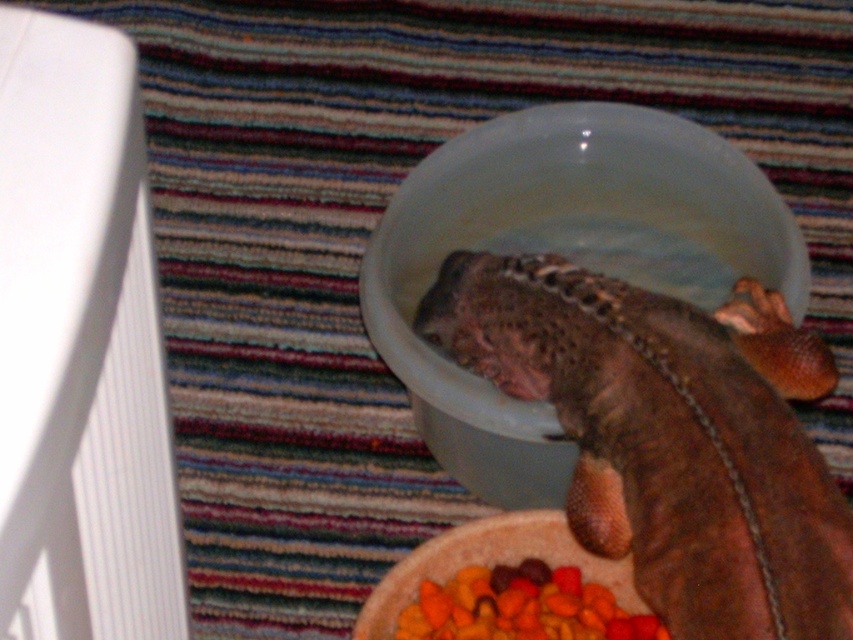
Which is above, brown scaly lizard at center or translucent plastic bowl at center?

translucent plastic bowl at center is above.

Which of these two, brown scaly lizard at center or translucent plastic bowl at center, stands taller?

translucent plastic bowl at center

Where is `brown scaly lizard at center`? The width and height of the screenshot is (853, 640). brown scaly lizard at center is located at coordinates (669, 436).

Image resolution: width=853 pixels, height=640 pixels. In order to click on brown scaly lizard at center in this screenshot , I will do `click(669, 436)`.

Is translucent plastic bowl at center bigger than carrot-like pieces at lower center?

Correct, translucent plastic bowl at center is larger in size than carrot-like pieces at lower center.

Does point (753, 198) come in front of point (552, 625)?

No, (753, 198) is behind (552, 625).

Identify the location of translucent plastic bowl at center. This screenshot has width=853, height=640. (566, 256).

Is brown scaly lizard at center thinner than carrot-like pieces at lower center?

No.

Who is positioned more to the left, brown scaly lizard at center or carrot-like pieces at lower center?

From the viewer's perspective, carrot-like pieces at lower center appears more on the left side.

Consider the image. Measure the distance between brown scaly lizard at center and camera.

They are 31.41 inches apart.

You are a GUI agent. You are given a task and a screenshot of the screen. Output one action in this format:
    pyautogui.click(x=<x>, y=<y>)
    Task: Click on the brown scaly lizard at center
    
    Given the screenshot: What is the action you would take?
    pyautogui.click(x=669, y=436)